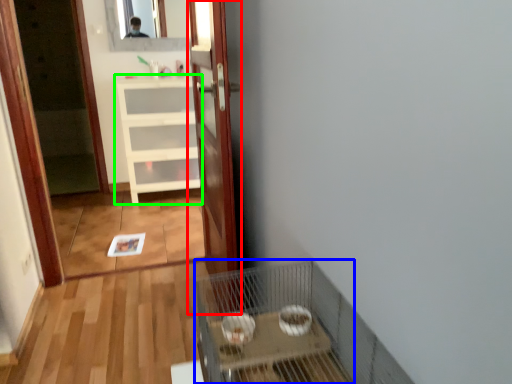
Question: Based on their relative distances, which object is nearer to door (highlighted by a red box)? Choose from cage (highlighted by a blue box) and cabinetry (highlighted by a green box).

Choices:
 (A) cage
 (B) cabinetry

Answer: (A)